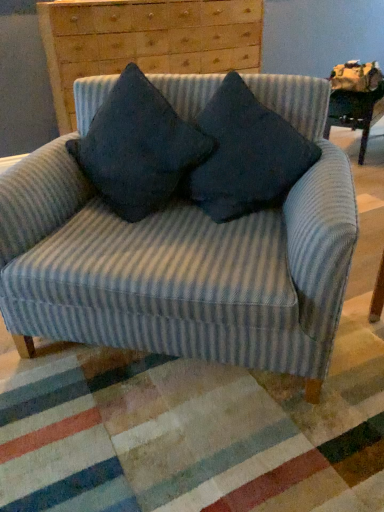
Question: Is blue striped fabric chair at center at the right side of dark blue fabric pillow at center, positioned as the 2th pillow in left-to-right order?

Choices:
 (A) yes
 (B) no

Answer: (B)

Question: Considering the relative sizes of blue striped fabric chair at center and dark blue fabric pillow at center, which is the 1th pillow in right-to-left order, in the image provided, is blue striped fabric chair at center smaller than dark blue fabric pillow at center, which is the 1th pillow in right-to-left order,?

Choices:
 (A) no
 (B) yes

Answer: (A)

Question: Is dark blue fabric pillow at center, which is the 1th pillow in right-to-left order, completely or partially inside blue striped fabric chair at center?

Choices:
 (A) yes
 (B) no

Answer: (A)

Question: Is the surface of blue striped fabric chair at center in direct contact with dark blue fabric pillow at center, positioned as the 2th pillow in left-to-right order?

Choices:
 (A) yes
 (B) no

Answer: (B)

Question: Is blue striped fabric chair at center outside dark blue fabric pillow at center, positioned as the 2th pillow in left-to-right order?

Choices:
 (A) no
 (B) yes

Answer: (B)

Question: Is wooden chest of drawers at upper center in front of or behind dark blue fabric pillow at center, the 2th pillow viewed from the right, in the image?

Choices:
 (A) front
 (B) behind

Answer: (B)

Question: Does point 200,72 appear closer or farther from the camera than point 190,158?

Choices:
 (A) farther
 (B) closer

Answer: (A)

Question: From a real-world perspective, is wooden chest of drawers at upper center physically located above or below dark blue fabric pillow at center, which is counted as the first pillow, starting from the left?

Choices:
 (A) above
 (B) below

Answer: (A)

Question: From their relative heights in the image, would you say wooden chest of drawers at upper center is taller or shorter than dark blue fabric pillow at center, which is counted as the first pillow, starting from the left?

Choices:
 (A) short
 (B) tall

Answer: (B)

Question: From the image's perspective, is wooden chest of drawers at upper center positioned above or below blue striped fabric chair at center?

Choices:
 (A) above
 (B) below

Answer: (A)

Question: Do you think wooden chest of drawers at upper center is within blue striped fabric chair at center, or outside of it?

Choices:
 (A) outside
 (B) inside

Answer: (A)

Question: Would you say wooden chest of drawers at upper center is to the left or to the right of blue striped fabric chair at center in the picture?

Choices:
 (A) left
 (B) right

Answer: (A)

Question: Considering the positions of wooden chest of drawers at upper center and blue striped fabric chair at center in the image, is wooden chest of drawers at upper center bigger or smaller than blue striped fabric chair at center?

Choices:
 (A) small
 (B) big

Answer: (A)

Question: From the image's perspective, relative to wooden chest of drawers at upper center, is dark blue fabric pillow at center, the 2th pillow viewed from the right, above or below?

Choices:
 (A) below
 (B) above

Answer: (A)

Question: In terms of height, does dark blue fabric pillow at center, the 2th pillow viewed from the right, look taller or shorter compared to wooden chest of drawers at upper center?

Choices:
 (A) short
 (B) tall

Answer: (A)